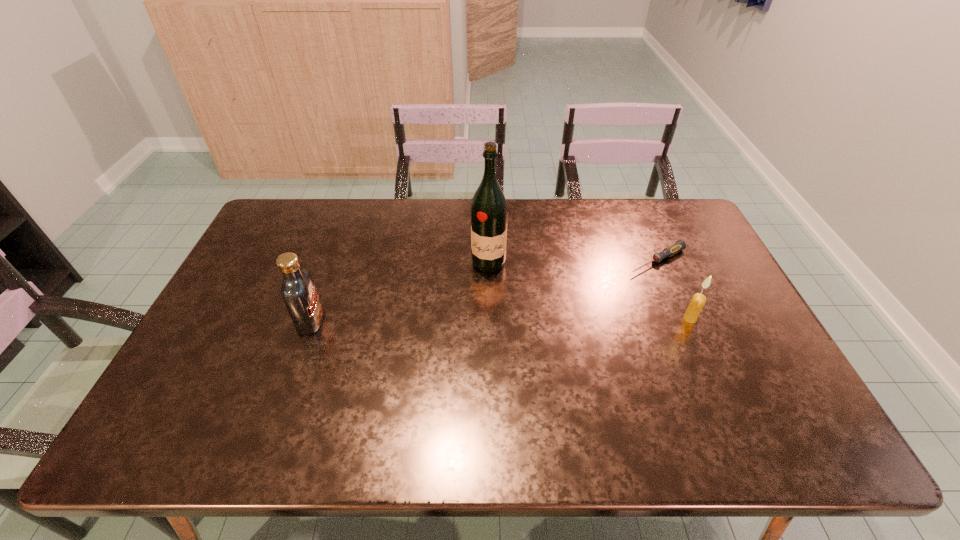
I want to click on unoccupied area between the screwdriver and the second tallest object, so click(x=484, y=291).

Where is `object that is the second closest to the liquor`? This screenshot has width=960, height=540. object that is the second closest to the liquor is located at coordinates (298, 291).

Identify which object is located as the second nearest to the screwdriver. Please provide its 2D coordinates. Your answer should be formatted as a tuple, i.e. [(x, y)], where the tuple contains the x and y coordinates of a point satisfying the conditions above.

[(489, 214)]

You are a GUI agent. You are given a task and a screenshot of the screen. Output one action in this format:
    pyautogui.click(x=<x>, y=<y>)
    Task: Click on the vacant area that satisfies the following two spatial constraints: 1. on the front side of the shortest object; 2. on the right side of the second shortest object
    
    Given the screenshot: What is the action you would take?
    tap(683, 319)

At what (x,y) coordinates should I click in order to perform the action: click on free space that satisfies the following two spatial constraints: 1. on the front side of the tallest object; 2. on the right side of the second shortest object. Please return your answer as a coordinate pair (x, y). This screenshot has width=960, height=540. Looking at the image, I should click on (490, 319).

Where is `free space in the image that satisfies the following two spatial constraints: 1. on the back side of the third object from right to left; 2. on the left side of the shortest object`? free space in the image that satisfies the following two spatial constraints: 1. on the back side of the third object from right to left; 2. on the left side of the shortest object is located at coordinates (489, 260).

You are a GUI agent. You are given a task and a screenshot of the screen. Output one action in this format:
    pyautogui.click(x=<x>, y=<y>)
    Task: Click on the vacant area that satisfies the following two spatial constraints: 1. on the back side of the screwdriver; 2. on the right side of the tallest object
    The height and width of the screenshot is (540, 960).
    Given the screenshot: What is the action you would take?
    pyautogui.click(x=489, y=260)